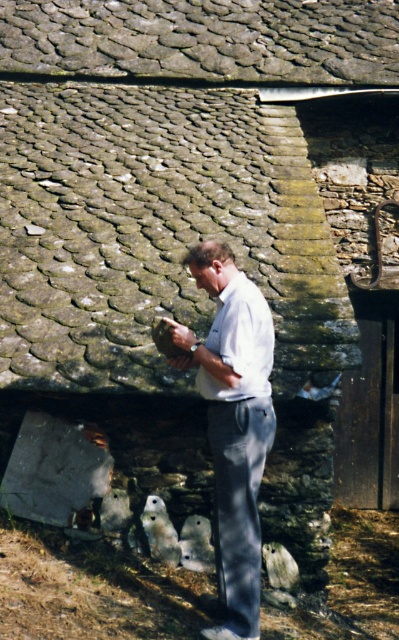
Which is behind, point (242, 605) or point (146, 506)?

The point (146, 506) is behind.

Is white cotton shirt at center to the left of white matte owl at lower center from the viewer's perspective?

In fact, white cotton shirt at center is to the right of white matte owl at lower center.

Find the location of `white cotton shirt at center`. white cotton shirt at center is located at coordinates (233, 422).